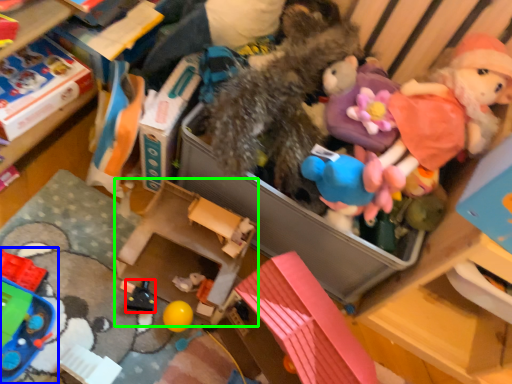
Question: Which is nearer to the toy (highlighted by a red box)? toy (highlighted by a blue box) or storage box (highlighted by a green box).

Choices:
 (A) toy
 (B) storage box

Answer: (B)